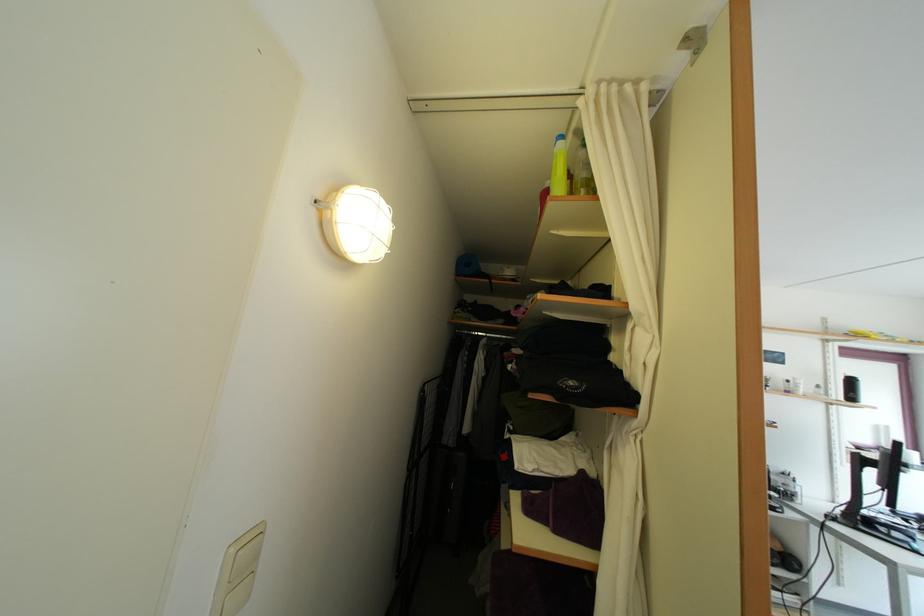
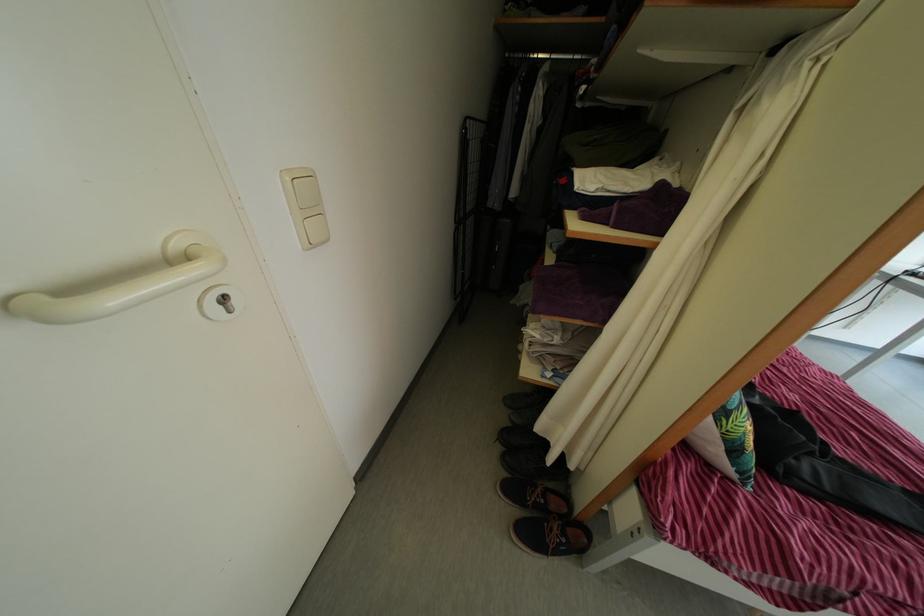
Find the pixel in the second image that matches the point at 239,559 in the first image.

(295, 187)